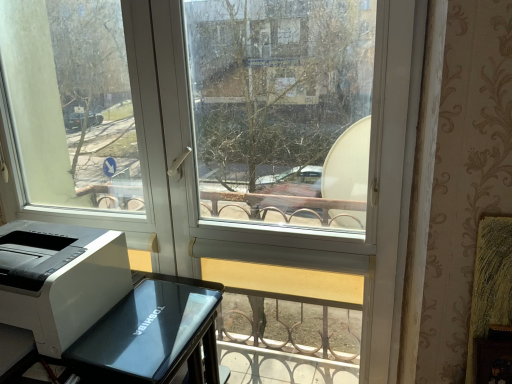
Locate an element on the screen. The image size is (512, 384). white plastic printer at lower left is located at coordinates (60, 279).

What do you see at coordinates (60, 279) in the screenshot?
I see `white plastic printer at lower left` at bounding box center [60, 279].

What do you see at coordinates (152, 334) in the screenshot? This screenshot has width=512, height=384. I see `white glossy printer at lower left` at bounding box center [152, 334].

Locate an element on the screen. This screenshot has height=384, width=512. white glossy printer at lower left is located at coordinates (152, 334).

The width and height of the screenshot is (512, 384). I want to click on white plastic printer at lower left, so click(x=60, y=279).

Is white glossy printer at lower left to the right of white plastic printer at lower left from the viewer's perspective?

Yes.

Considering their positions, is white glossy printer at lower left located in front of or behind white plastic printer at lower left?

white glossy printer at lower left is positioned closer to the viewer than white plastic printer at lower left.

Is point (151, 328) positioned after point (93, 261)?

Yes, it is behind point (93, 261).

From the image's perspective, between white glossy printer at lower left and white plastic printer at lower left, which one is located above?

white plastic printer at lower left is shown above in the image.

From a real-world perspective, is white glossy printer at lower left positioned above or below white plastic printer at lower left?

white glossy printer at lower left is situated lower than white plastic printer at lower left in the real world.

Is white glossy printer at lower left thinner than white plastic printer at lower left?

In fact, white glossy printer at lower left might be wider than white plastic printer at lower left.

Who is shorter, white glossy printer at lower left or white plastic printer at lower left?

Standing shorter between the two is white plastic printer at lower left.

Consider the image. Considering the sizes of objects white glossy printer at lower left and white plastic printer at lower left in the image provided, who is bigger, white glossy printer at lower left or white plastic printer at lower left?

white glossy printer at lower left.

Is white glossy printer at lower left outside of white plastic printer at lower left?

white glossy printer at lower left lies outside white plastic printer at lower left's area.

Are white glossy printer at lower left and white plastic printer at lower left located far from each other?

No.

Is white glossy printer at lower left oriented towards white plastic printer at lower left?

No, white glossy printer at lower left is not oriented towards white plastic printer at lower left.

Can you tell me how much white glossy printer at lower left and white plastic printer at lower left differ in facing direction?

The angle between the facing direction of white glossy printer at lower left and the facing direction of white plastic printer at lower left is 3.12 degrees.

Measure the distance from white glossy printer at lower left to white plastic printer at lower left.

white glossy printer at lower left and white plastic printer at lower left are 7.31 inches apart from each other.

The image size is (512, 384). In order to click on furniture in front of the white plastic printer at lower left in this screenshot , I will do `click(152, 334)`.

Does white plastic printer at lower left appear on the right side of white glossy printer at lower left?

No, white plastic printer at lower left is not to the right of white glossy printer at lower left.

Consider the image. Which object is closer to the camera taking this photo, white plastic printer at lower left or white glossy printer at lower left?

white glossy printer at lower left is more forward.

Does point (92, 279) come in front of point (175, 287)?

Yes, point (92, 279) is closer to viewer.

From the image's perspective, which is above, white plastic printer at lower left or white glossy printer at lower left?

white plastic printer at lower left is shown above in the image.

From a real-world perspective, is white plastic printer at lower left under white glossy printer at lower left?

No, from a real-world perspective, white plastic printer at lower left is not beneath white glossy printer at lower left.

In terms of width, does white plastic printer at lower left look wider or thinner when compared to white glossy printer at lower left?

Clearly, white plastic printer at lower left has less width compared to white glossy printer at lower left.

Considering the relative sizes of white plastic printer at lower left and white glossy printer at lower left in the image provided, is white plastic printer at lower left taller than white glossy printer at lower left?

In fact, white plastic printer at lower left may be shorter than white glossy printer at lower left.

Based on their sizes in the image, would you say white plastic printer at lower left is bigger or smaller than white glossy printer at lower left?

white plastic printer at lower left is smaller than white glossy printer at lower left.

Is white plastic printer at lower left positioned beyond the bounds of white glossy printer at lower left?

Indeed, white plastic printer at lower left is completely outside white glossy printer at lower left.

Are white plastic printer at lower left and white glossy printer at lower left making contact?

No, white plastic printer at lower left is not touching white glossy printer at lower left.

Is white plastic printer at lower left oriented towards white glossy printer at lower left?

No, white plastic printer at lower left is not facing towards white glossy printer at lower left.

This screenshot has width=512, height=384. What are the coordinates of `printer behind the white glossy printer at lower left` in the screenshot? It's located at (60, 279).

Image resolution: width=512 pixels, height=384 pixels. In order to click on printer behind the white glossy printer at lower left in this screenshot , I will do `click(60, 279)`.

Find the location of `furniture lying on the right of white plastic printer at lower left`. furniture lying on the right of white plastic printer at lower left is located at coordinates (x=152, y=334).